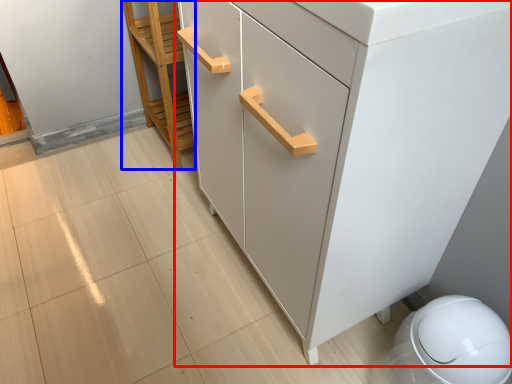
Question: Among these objects, which one is farthest to the camera, chest of drawers (highlighted by a red box) or furniture (highlighted by a blue box)?

Choices:
 (A) chest of drawers
 (B) furniture

Answer: (B)